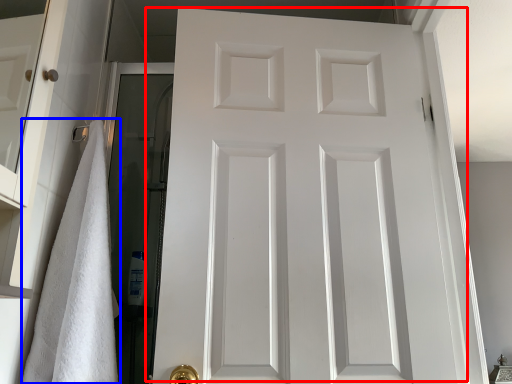
Question: Which object is closer to the camera taking this photo, door (highlighted by a red box) or bath towel (highlighted by a blue box)?

Choices:
 (A) door
 (B) bath towel

Answer: (B)